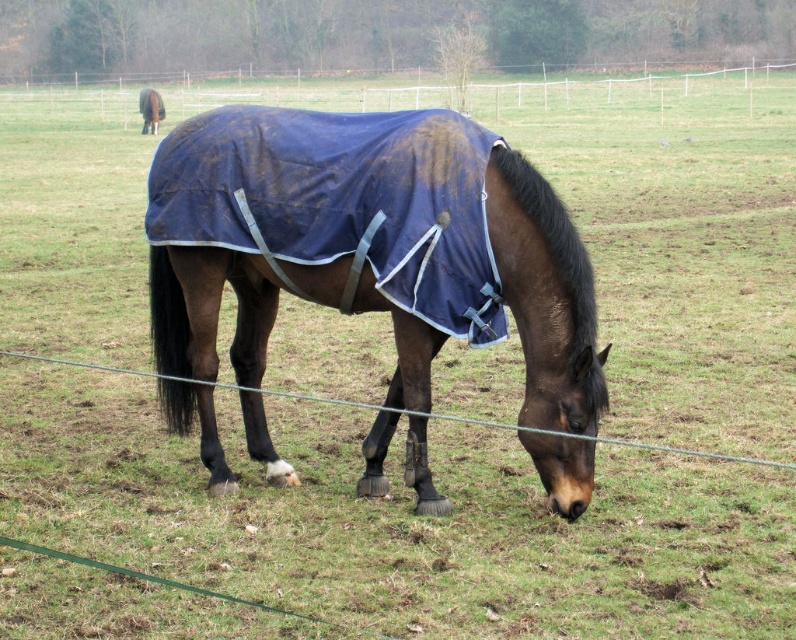
You are a farmer checking the condition of the horse equipment. You notice the dull blue fabric at center and the white plastic fence at upper center. Which object is narrower in width?

The dull blue fabric at center is thinner than the white plastic fence at upper center, so the dull blue fabric at center is narrower in width.

You are a farmer checking the condition of your horses. You notice the blue fabric blanket at center and the brown glossy horse at upper left. Which object is positioned lower in the image?

The blue fabric blanket at center is below the brown glossy horse at upper left, so the blue fabric blanket at center is positioned lower in the image.